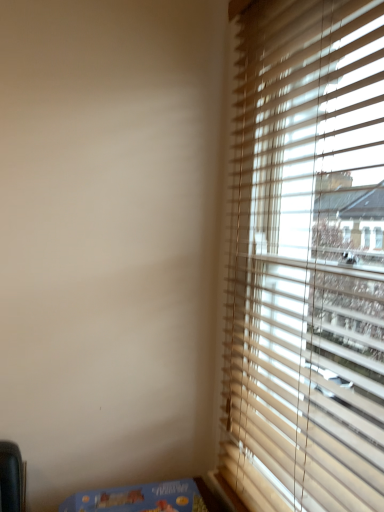
Question: Is blue cardboard box at lower left situated inside wooden blinds at right or outside?

Choices:
 (A) outside
 (B) inside

Answer: (A)

Question: From the image's perspective, relative to wooden blinds at right, is blue cardboard box at lower left above or below?

Choices:
 (A) above
 (B) below

Answer: (B)

Question: In terms of width, does blue cardboard box at lower left look wider or thinner when compared to wooden blinds at right?

Choices:
 (A) wide
 (B) thin

Answer: (A)

Question: From a real-world perspective, relative to blue cardboard box at lower left, is wooden blinds at right vertically above or below?

Choices:
 (A) below
 (B) above

Answer: (B)

Question: Is wooden blinds at right wider or thinner than blue cardboard box at lower left?

Choices:
 (A) wide
 (B) thin

Answer: (B)

Question: From the image's perspective, is wooden blinds at right positioned above or below blue cardboard box at lower left?

Choices:
 (A) above
 (B) below

Answer: (A)

Question: From their relative heights in the image, would you say wooden blinds at right is taller or shorter than blue cardboard box at lower left?

Choices:
 (A) short
 (B) tall

Answer: (B)